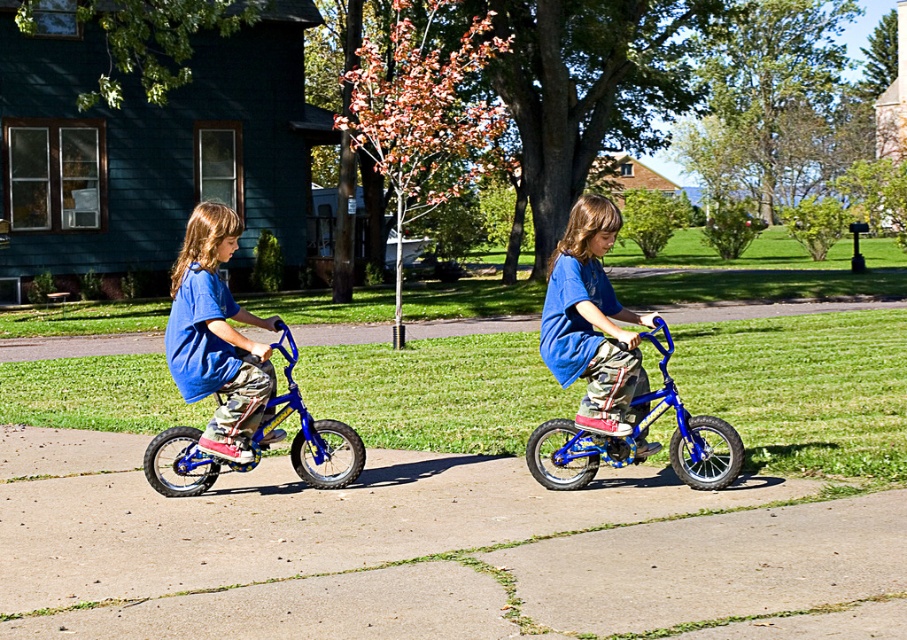
Question: In this image, where is matte blue shirt at left located relative to blue metallic bicycle at center?

Choices:
 (A) above
 (B) below

Answer: (A)

Question: Which point is closer to the camera?

Choices:
 (A) (457, 465)
 (B) (671, 385)
 (C) (318, 480)
 (D) (577, 312)

Answer: (B)

Question: Does matte blue shirt at left have a greater width compared to shiny blue bicycle at left?

Choices:
 (A) no
 (B) yes

Answer: (A)

Question: Estimate the real-world distances between objects in this image. Which object is closer to the matte blue shirt at center?

Choices:
 (A) blue metallic bicycle at center
 (B) shiny blue bicycle at left
 (C) matte blue shirt at left
 (D) smooth concrete pavement at center

Answer: (A)

Question: Is matte blue shirt at left to the right of shiny blue bicycle at left from the viewer's perspective?

Choices:
 (A) yes
 (B) no

Answer: (A)

Question: Considering the real-world distances, which object is closest to the matte blue shirt at center?

Choices:
 (A) matte blue shirt at left
 (B) smooth concrete pavement at center
 (C) blue metallic bicycle at center
 (D) shiny blue bicycle at left

Answer: (C)